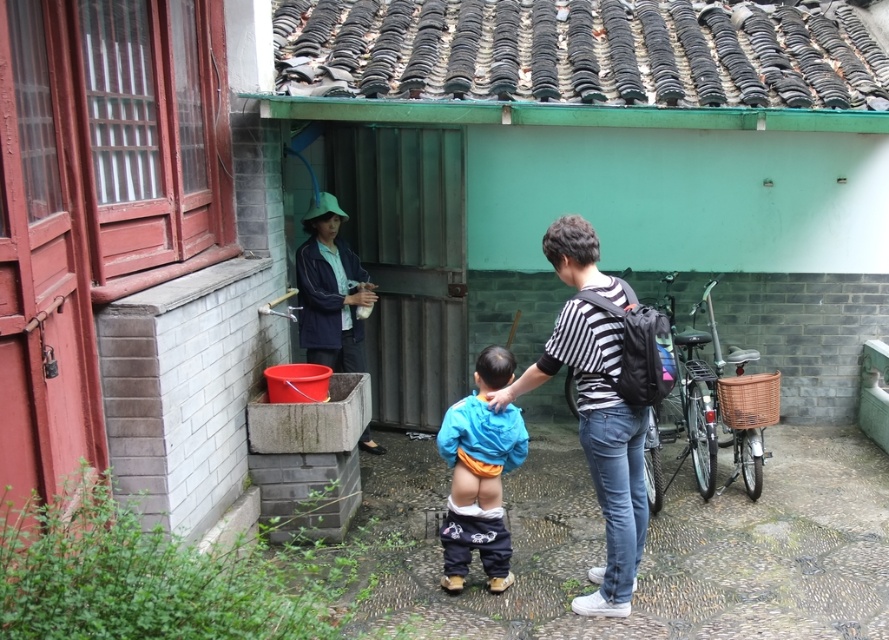
Between green painted brick wall at center and blue denim jacket at left, which one is positioned higher?

Answer: green painted brick wall at center is above.

Is green painted brick wall at center in front of blue denim jacket at left?

Yes.

Between point (651, 12) and point (323, 216), which one is positioned in front?

Point (323, 216)

Where is `green painted brick wall at center`? The image size is (889, 640). green painted brick wall at center is located at coordinates (630, 152).

Is point (162, 48) positioned in front of point (359, 276)?

Yes, point (162, 48) is closer to viewer.

Is smooth concrete wall at lower left thinner than blue denim jacket at left?

Indeed, smooth concrete wall at lower left has a lesser width compared to blue denim jacket at left.

The image size is (889, 640). Describe the element at coordinates (123, 259) in the screenshot. I see `smooth concrete wall at lower left` at that location.

You are a GUI agent. You are given a task and a screenshot of the screen. Output one action in this format:
    pyautogui.click(x=<x>, y=<y>)
    Task: Click on the smooth concrete wall at lower left
    This screenshot has width=889, height=640.
    Given the screenshot: What is the action you would take?
    [x=123, y=259]

Which is more to the left, green painted brick wall at center or blue cotton jacket at center?

Positioned to the left is blue cotton jacket at center.

Can you confirm if green painted brick wall at center is positioned to the right of blue cotton jacket at center?

Correct, you'll find green painted brick wall at center to the right of blue cotton jacket at center.

Between point (881, 176) and point (483, 502), which one is positioned behind?

The point (881, 176) is behind.

At what (x,y) coordinates should I click in order to perform the action: click on green painted brick wall at center. Please return your answer as a coordinate pair (x, y). Looking at the image, I should click on [630, 152].